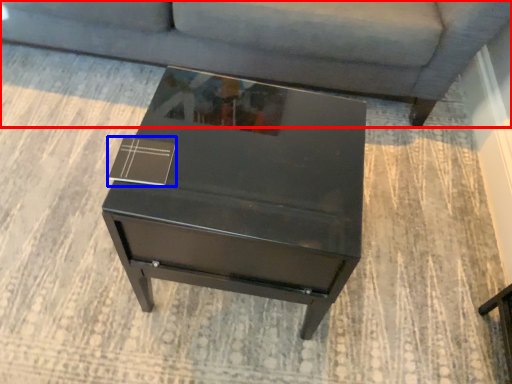
Question: Which object is closer to the camera taking this photo, studio couch (highlighted by a red box) or square (highlighted by a blue box)?

Choices:
 (A) studio couch
 (B) square

Answer: (B)